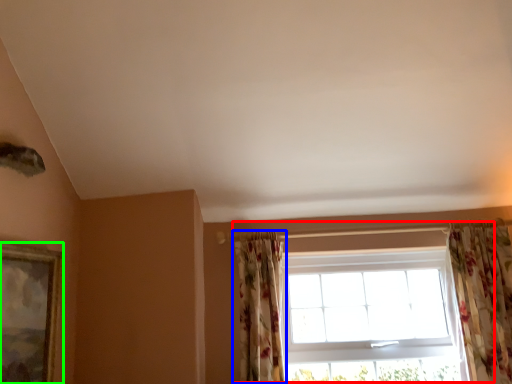
Question: Which object is the closest to the window (highlighted by a red box)? Choose among these: curtain (highlighted by a blue box) or picture frame (highlighted by a green box).

Choices:
 (A) curtain
 (B) picture frame

Answer: (A)